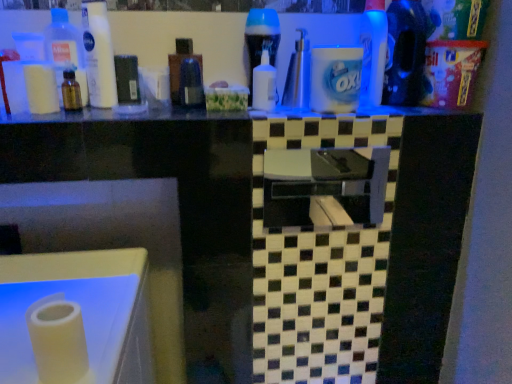
Identify the location of free space that is to the left of white matte bottle at center, which is the second bottle in right-to-left order. (185, 111).